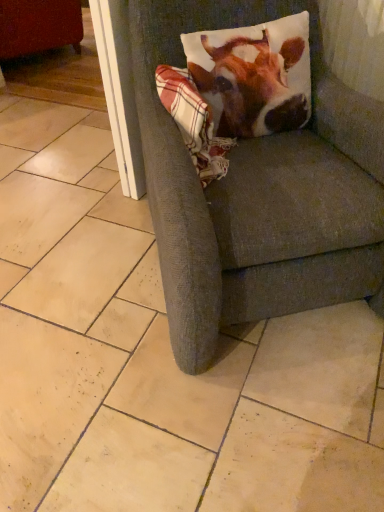
At what (x,y) coordinates should I click in order to perform the action: click on vacant space situated on the left part of white glossy screen door at upper left. Please return your answer as a coordinate pair (x, y). This screenshot has height=512, width=384. Looking at the image, I should click on (94, 183).